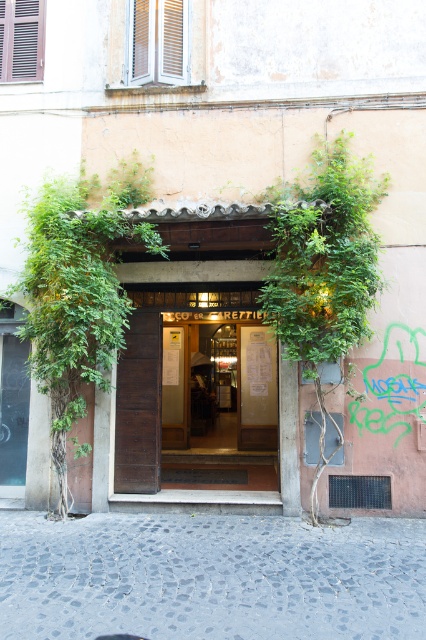
Question: Is green leafy plant at center to the left of wooden door at center from the viewer's perspective?

Choices:
 (A) no
 (B) yes

Answer: (B)

Question: Which object appears farthest from the camera in this image?

Choices:
 (A) wooden door at center
 (B) green leafy plant at center

Answer: (A)

Question: Does green leafy plant at center have a lesser width compared to wooden door at center?

Choices:
 (A) no
 (B) yes

Answer: (A)

Question: Is green leafy plant at center further to camera compared to wooden door at center?

Choices:
 (A) yes
 (B) no

Answer: (B)

Question: Which point appears farthest from the camera in this image?

Choices:
 (A) (230, 358)
 (B) (49, 212)

Answer: (A)